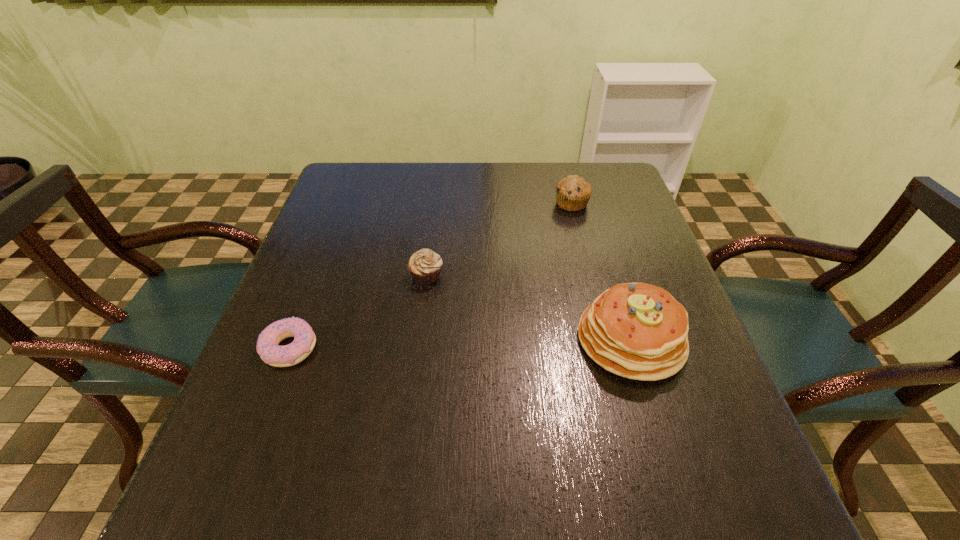
Find the location of `vacant region located on the right of the leftmost object`. vacant region located on the right of the leftmost object is located at coordinates (403, 347).

Locate an element on the screen. object present at the far edge is located at coordinates pyautogui.click(x=573, y=192).

Where is `object that is at the left edge`? object that is at the left edge is located at coordinates (268, 347).

This screenshot has width=960, height=540. What are the coordinates of `pancake that is positioned at the right edge` in the screenshot? It's located at (639, 331).

Locate an element on the screen. The image size is (960, 540). muffin at the right edge is located at coordinates (573, 192).

The height and width of the screenshot is (540, 960). In order to click on object at the far right corner in this screenshot , I will do `click(573, 192)`.

In the image, there is a desktop. Where is `vacant area at the far edge`? The image size is (960, 540). vacant area at the far edge is located at coordinates (460, 179).

The image size is (960, 540). I want to click on blank space at the near edge of the desktop, so click(319, 504).

In the image, there is a desktop. Where is `vacant space at the left edge`? The height and width of the screenshot is (540, 960). vacant space at the left edge is located at coordinates (323, 233).

This screenshot has width=960, height=540. I want to click on vacant space at the right edge of the desktop, so click(x=658, y=268).